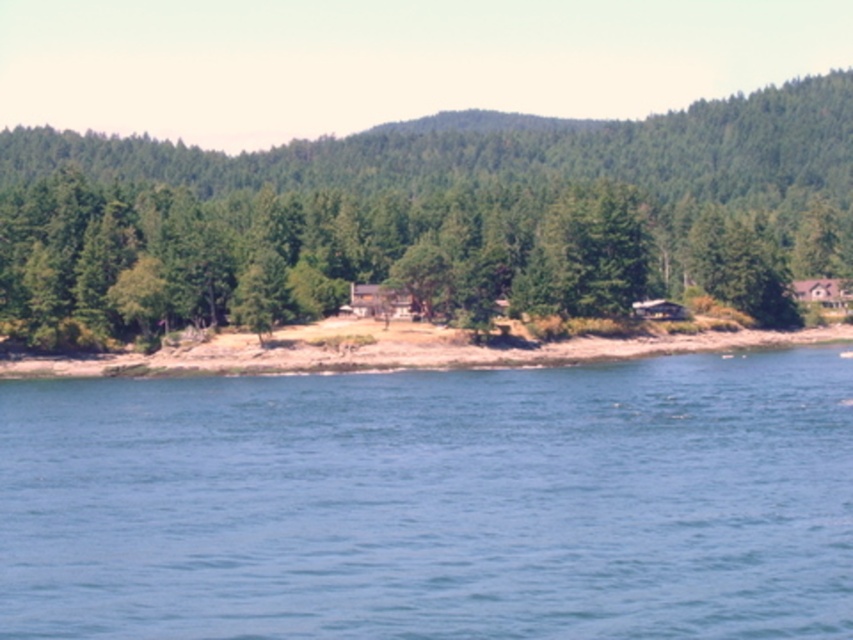
You are standing on the brown sandy shoreline at center and looking towards the green matte tree at center. Which object is higher in elevation?

The green matte tree at center is taller than the brown sandy shoreline at center, so the tree is higher in elevation.

You are standing on the brown sandy shoreline at center and want to walk to the green matte tree at center. Which direction should you face to move towards it?

You should face to the right because the green matte tree at center is located to the left of the brown sandy shoreline at center, so moving towards the left from the shoreline would lead you to the tree.

You are standing on the sandy shoreline looking towards the water. You see the blue water at lower center and the green matte tree at center. Which object is positioned to the right of the other?

The blue water at lower center is to the right of the green matte tree at center.